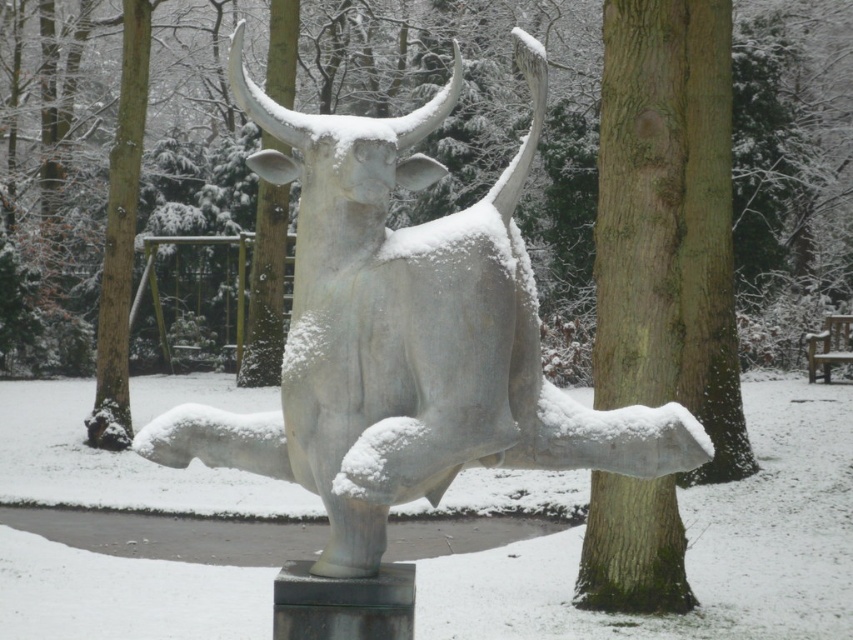
You are standing in the park and see the white marble bull at center and the smooth bark tree at center. Which object is positioned to the left from your perspective?

The white marble bull at center is positioned to the left of the smooth bark tree at center.

You are a park maintenance worker who needs to place a new bench in the park. The bench requires a 3 meter clearance from any object. Can you place the bench between the white marble bull at center and the smooth bark tree at center?

The distance between the white marble bull at center and the smooth bark tree at center is 10.86 meters. Since the bench requires 3 meters of clearance from both objects, there would be sufficient space between them to place the bench as long as it is positioned at least 3 meters away from each object. The total required space would be 6 meters, which is less than the 10.86 meters available.